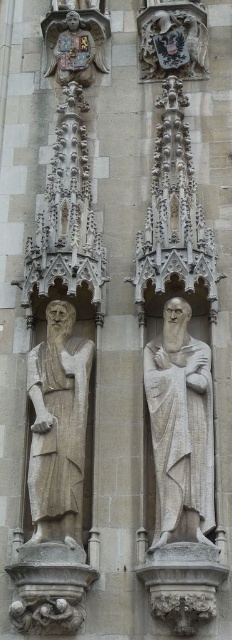
You are standing in front of a Gothic architectural facade and want to take a photo of the white stone statue at center. Considering the statue is 186.54 feet away from you, will it be possible to capture the entire statue in your smartphone camera frame?

The white stone statue at center is 186.54 feet away from the camera. At this distance, it is unlikely that a smartphone camera can capture the entire statue in a single frame due to the limited field of view and zoom capabilities of most smartphones. You may need to move closer or use a wide angle lens to ensure the entire statue fits in the photo.